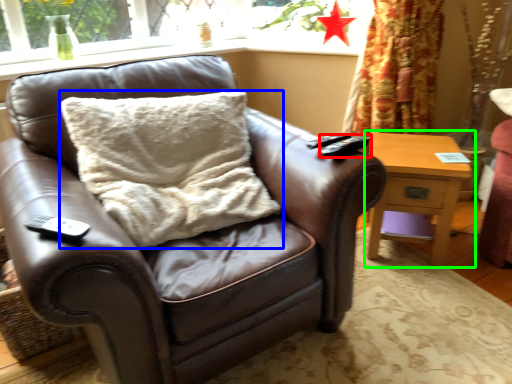
Question: Which is farther away from remote (highlighted by a red box)? pillow (highlighted by a blue box) or nightstand (highlighted by a green box)?

Choices:
 (A) pillow
 (B) nightstand

Answer: (B)